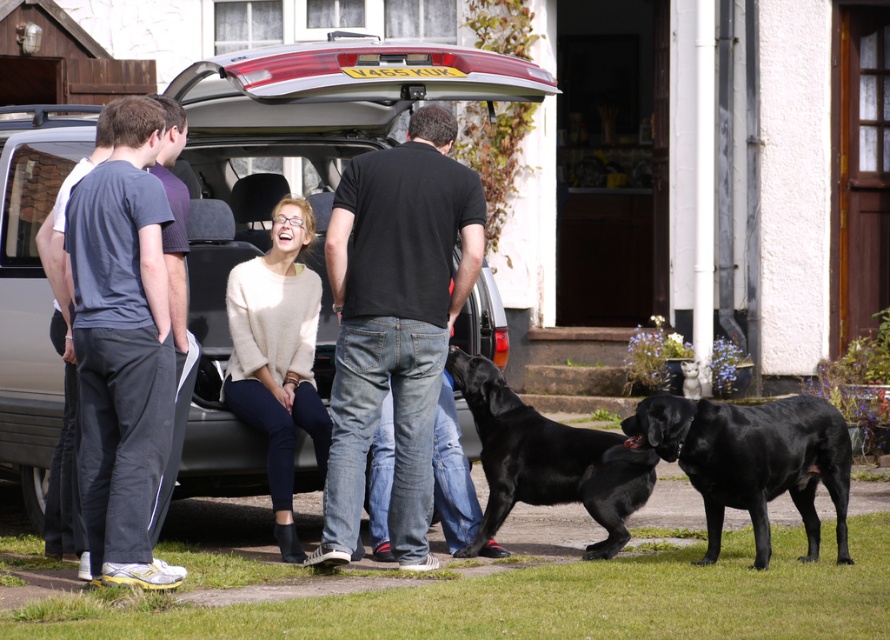
You are a delivery person who needs to leave a package at the house in the background. The package must be placed exactly at the position of the light beige sweater at center. What are the coordinates where you should place the package?

The coordinates for the light beige sweater at center are at point (278,356), so the package should be placed there.

You are a delivery person who needs to place a package on the car. The package is too heavy to lift, so you must slide it from the ground. The package is currently at the position of the light beige sweater at center. The black matte dog at center is blocking the path to the car. Can you move the package to the car without moving the dog?

The light beige sweater at center is to the left of the black matte dog at center. Since the dog is blocking the path, you can slide the package to the right around the dog to reach the car.